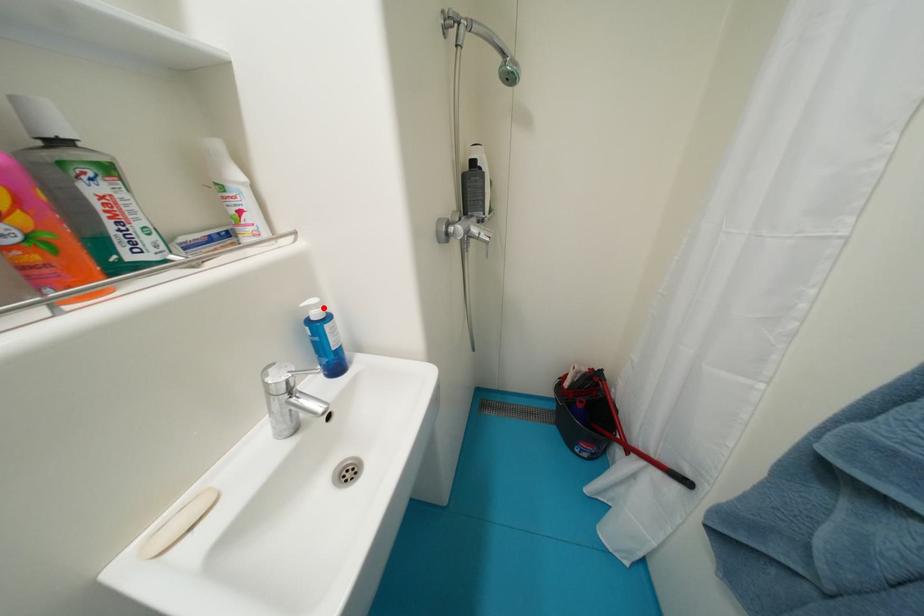
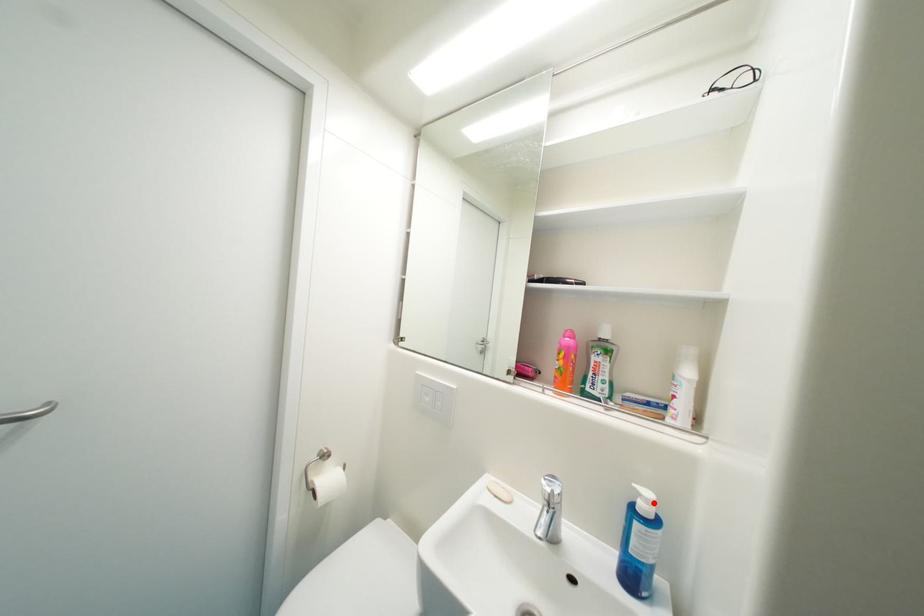
I am providing you with two images of the same scene from different viewpoints. A red point is marked on the first image and another point is marked on the second image. Is the marked point in image1 the same physical position as the marked point in image2?

Yes